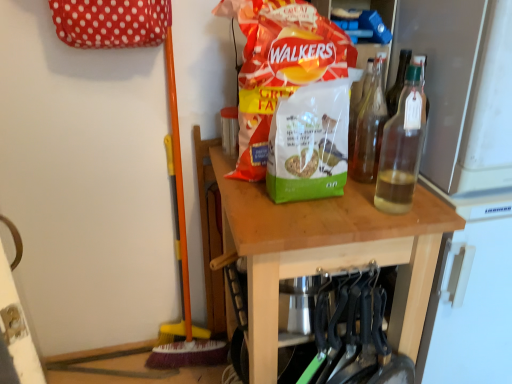
Where is `free space between green matte birdseed bag at center, which is the second waste in top-to-bottom order, and matte plastic bag of walkers crisps at center, the second waste positioned from the bottom`? free space between green matte birdseed bag at center, which is the second waste in top-to-bottom order, and matte plastic bag of walkers crisps at center, the second waste positioned from the bottom is located at coordinates (269, 207).